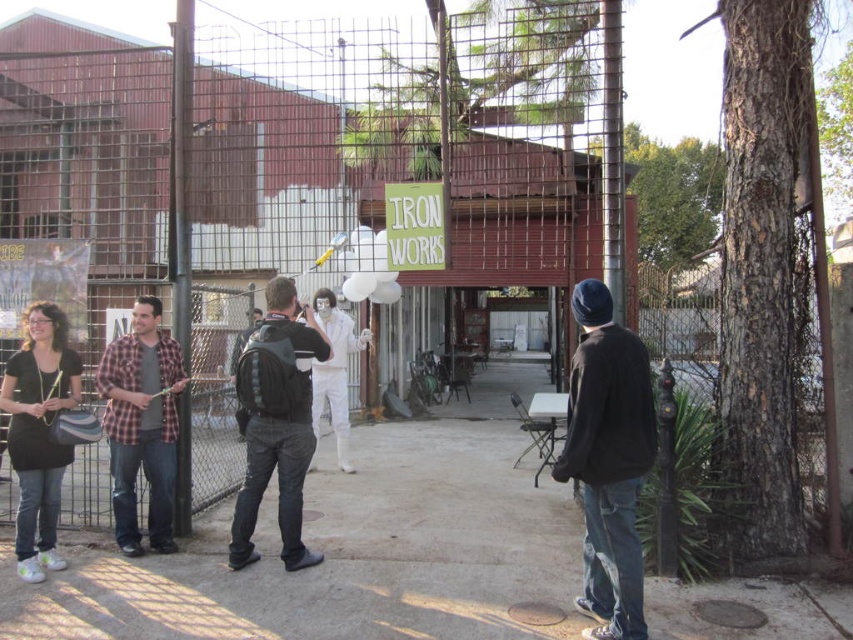
You are standing at the entrance of the IRON WORKS building and want to place a new sign that is 0.5 meters wide on the fence. The existing sign is already occupying the space at point 0.661, 0.326 where the black backpack at center is located. Is there enough space on the fence to place the new sign without overlapping the existing sign?

The black backpack at center is located at point (x=277, y=422) on the fence. Since the new sign is 0.5 meters wide, there might be enough space depending on the total length of the fence. However, the exact dimensions of the fence and the distance between the existing sign and other potential obstacles are not provided, so it is uncertain if there is sufficient space available.

You are organizing a photo shoot in this IRON WORKS workshop area. You have a black backpack at center and a white matte suit at center in the scene. Which object should you move if you want to make sure the smaller item is placed to the right of the larger one?

The black backpack at center is smaller than the white matte suit at center. To place the smaller item to the right of the larger one, you should move the black backpack at center to the right side since it is smaller and needs to be positioned to the right of the larger white matte suit at center.